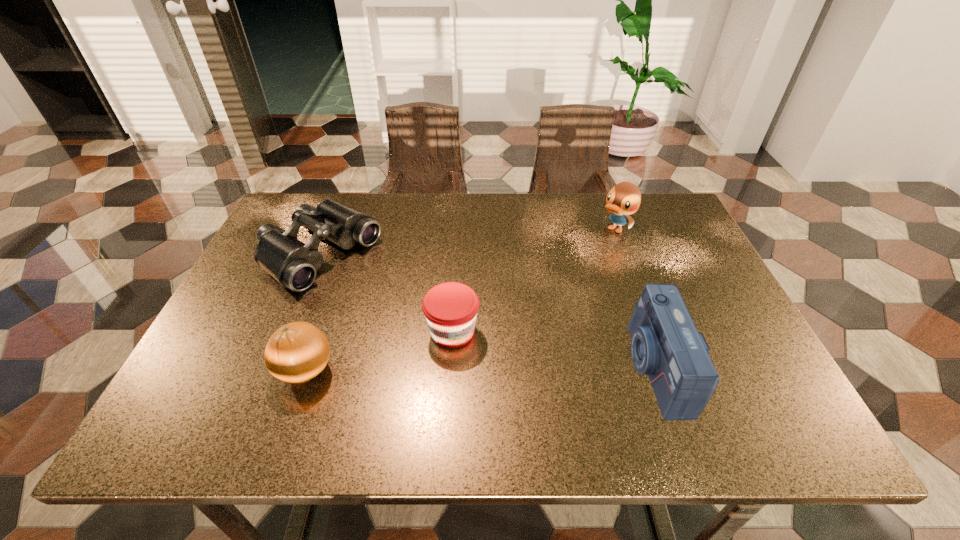
Locate an element on the screen. The image size is (960, 540). free space located 0.310m on the front-facing side of the binoculars is located at coordinates (452, 336).

Image resolution: width=960 pixels, height=540 pixels. Find the location of `free space located 0.270m on the front-facing side of the binoculars`. free space located 0.270m on the front-facing side of the binoculars is located at coordinates (439, 328).

Where is `vacant space located 0.350m on the front-facing side of the binoculars`? This screenshot has height=540, width=960. vacant space located 0.350m on the front-facing side of the binoculars is located at coordinates (466, 345).

The image size is (960, 540). What are the coordinates of `free space located on the label side of the shortest object` in the screenshot? It's located at (571, 387).

Where is `vacant position located 0.070m on the label side of the shortest object`? vacant position located 0.070m on the label side of the shortest object is located at coordinates (503, 355).

I want to click on vacant space situated on the label side of the shortest object, so click(x=586, y=394).

This screenshot has width=960, height=540. In order to click on vacant space located 0.080m on the front-facing side of the duck in this screenshot , I will do `click(590, 251)`.

The height and width of the screenshot is (540, 960). In order to click on vacant area located 0.250m on the front-facing side of the duck in this screenshot , I will do coord(554,281).

Where is `vacant space situated on the front-facing side of the duck`? This screenshot has height=540, width=960. vacant space situated on the front-facing side of the duck is located at coordinates (565, 272).

Locate an element on the screen. This screenshot has height=540, width=960. binoculars at the far edge is located at coordinates (292, 263).